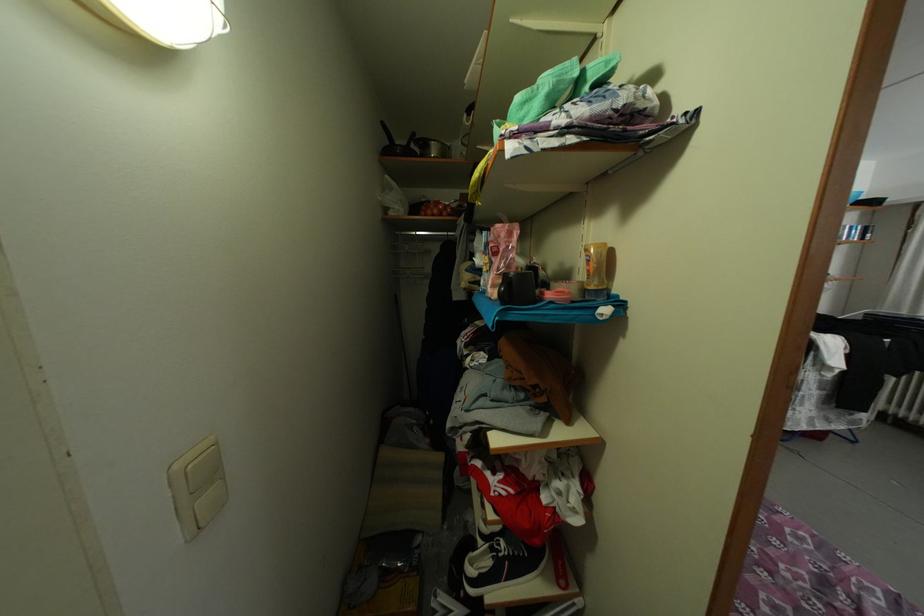
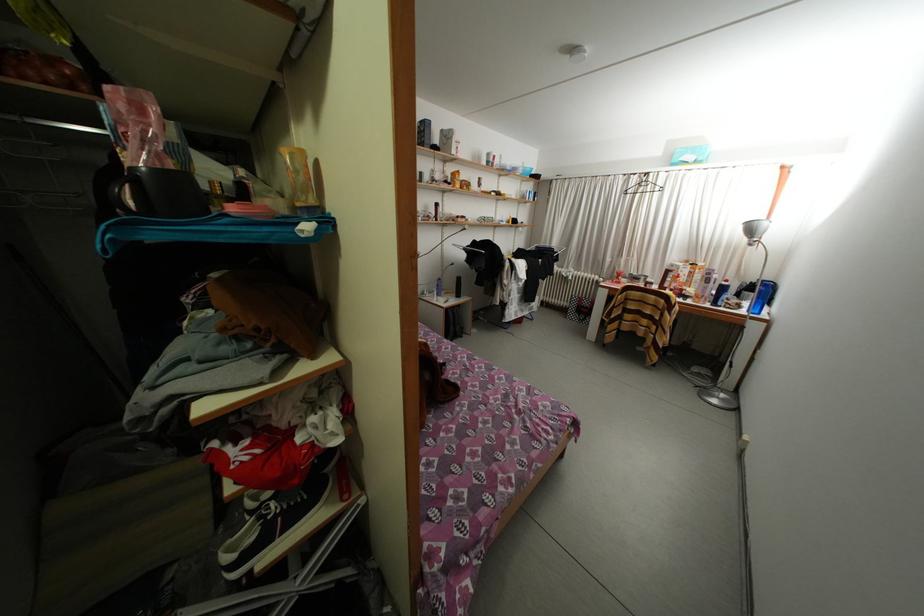
Find the pixel in the second image that matches (453,219) in the first image.

(91, 92)